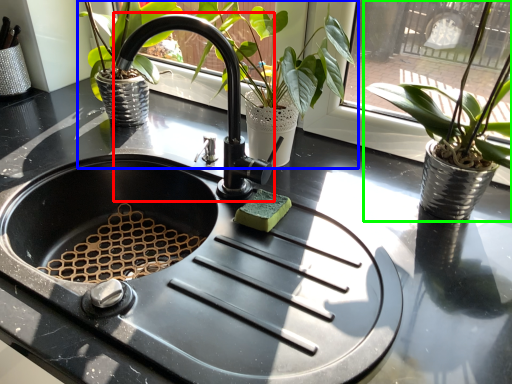
Question: Which object is positioned farthest from faucet (highlighted by a red box)? Select from houseplant (highlighted by a blue box) and houseplant (highlighted by a green box).

Choices:
 (A) houseplant
 (B) houseplant

Answer: (B)